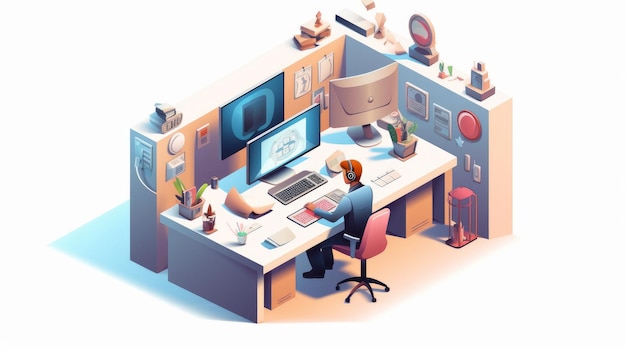
You are a GUI agent. You are given a task and a screenshot of the screen. Output one action in this format:
    pyautogui.click(x=<x>, y=<y>)
    Task: Click on the keyboard
    The image size is (626, 351).
    Given the screenshot: What is the action you would take?
    pyautogui.click(x=290, y=191)